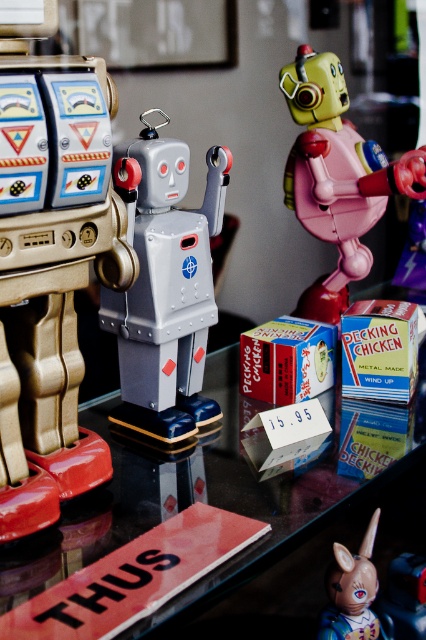
Which of these two, metallic pink robot at center or matte plastic unicorn at lower right, stands shorter?

matte plastic unicorn at lower right

Which is below, metallic pink robot at center or matte plastic unicorn at lower right?

matte plastic unicorn at lower right

Between point (284, 186) and point (374, 568), which one is positioned behind?

The point (284, 186) is more distant.

Find the location of a particular element. metallic pink robot at center is located at coordinates (336, 177).

Between gold metallic robot at left and metallic silver robot at center, which one is positioned lower?

gold metallic robot at left is lower down.

Who is more distant from viewer, (69, 216) or (146, 131)?

The point (146, 131) is more distant.

Locate an element on the screen. gold metallic robot at left is located at coordinates (54, 289).

Does gold metallic robot at left appear on the right side of metallic pink robot at center?

Incorrect, gold metallic robot at left is not on the right side of metallic pink robot at center.

Is gold metallic robot at left shorter than metallic pink robot at center?

No.

Does point (83, 61) come farther from viewer compared to point (310, 67)?

No.

At what (x,y) coordinates should I click in order to perform the action: click on gold metallic robot at left. Please return your answer as a coordinate pair (x, y). The width and height of the screenshot is (426, 640). Looking at the image, I should click on (54, 289).